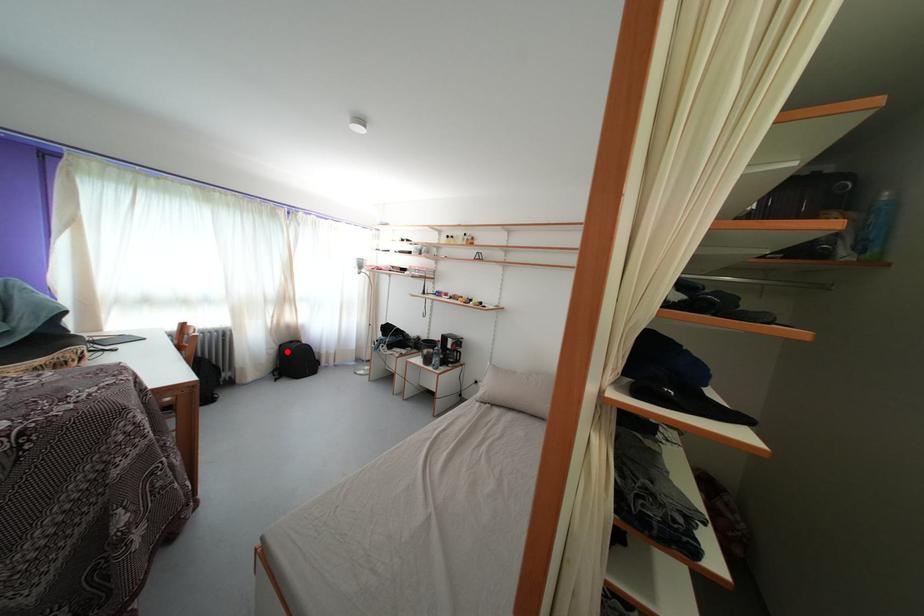
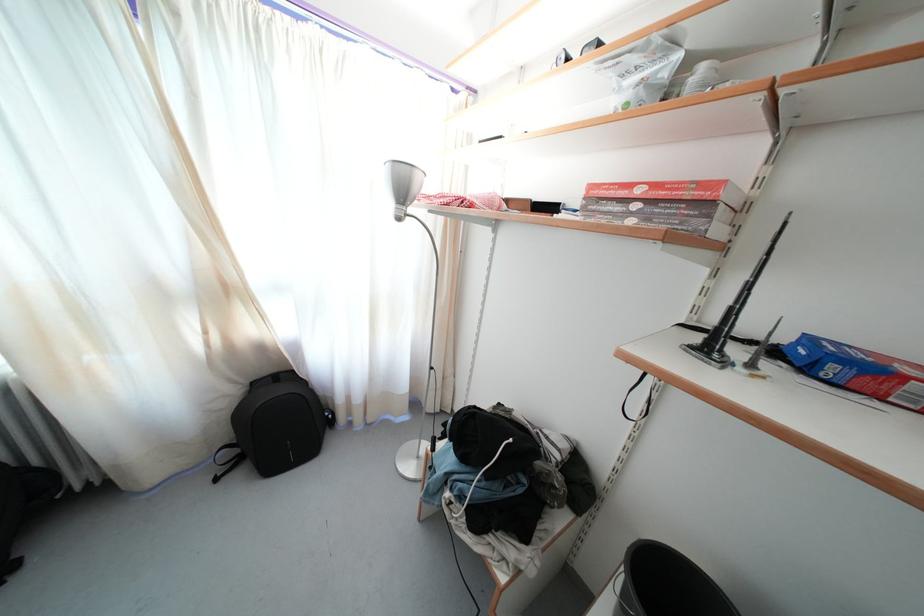
Question: I am providing you with two images of the same scene from different viewpoints. Image1 has a red point marked. In image2, the corresponding 3D location appears at what relative position? Reply with the corresponding letter.

Choices:
 (A) Closer
 (B) Farther

Answer: (B)